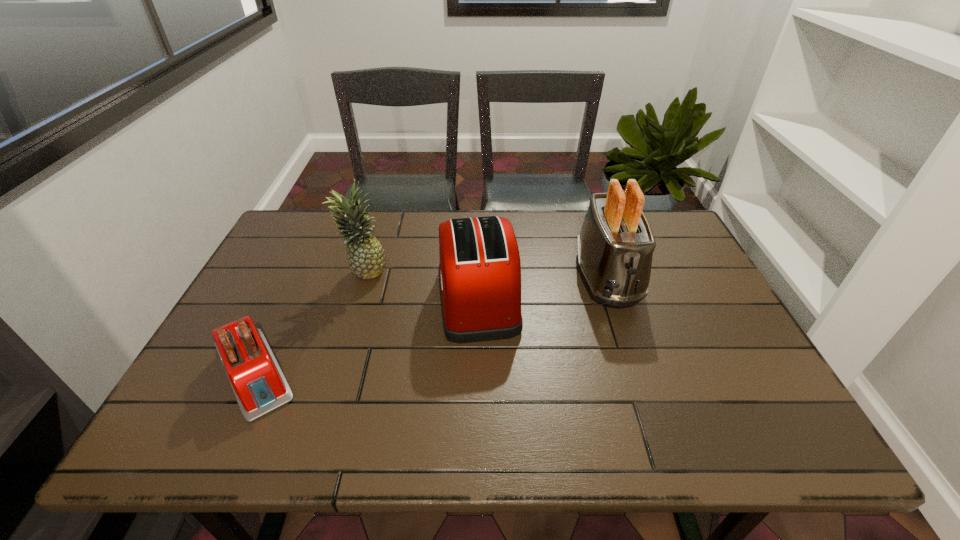
Locate an element on the screen. This screenshot has width=960, height=540. object identified as the third closest to the second object from right to left is located at coordinates (259, 385).

Find the location of a particular element. the closest toaster to the leftmost toaster is located at coordinates (479, 272).

Locate an element on the screen. The width and height of the screenshot is (960, 540). toaster object that ranks as the second closest to the pineapple is located at coordinates (259, 385).

At what (x,y) coordinates should I click in order to perform the action: click on free location that satisfies the following two spatial constraints: 1. on the front side of the second toaster from right to left; 2. on the right side of the second object from left to right. Please return your answer as a coordinate pair (x, y). Looking at the image, I should click on click(x=356, y=299).

This screenshot has height=540, width=960. What are the coordinates of `free space that satisfies the following two spatial constraints: 1. on the front side of the pineapple; 2. on the left side of the second object from right to left` in the screenshot? It's located at (356, 299).